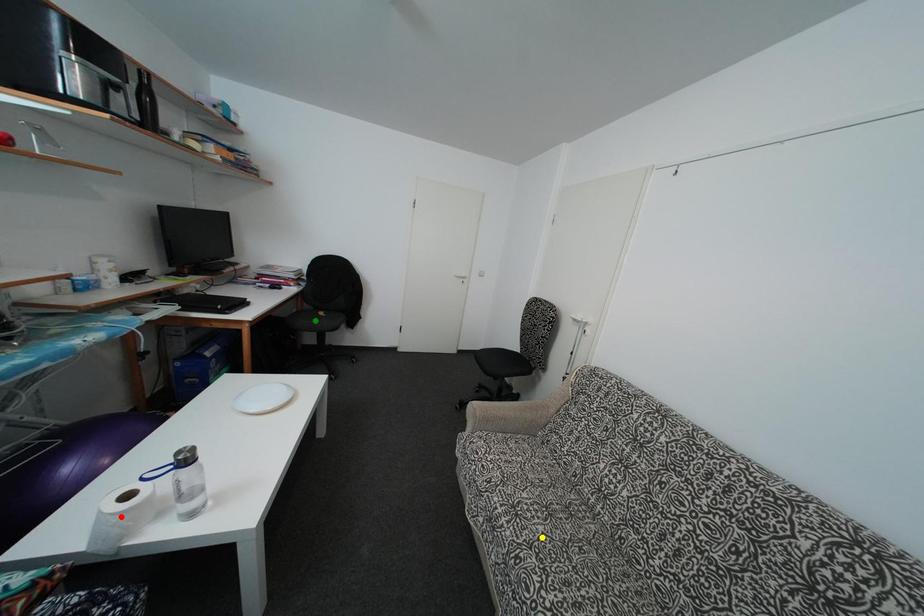
Order these from nearest to farthest:
yellow point
green point
red point

red point
yellow point
green point